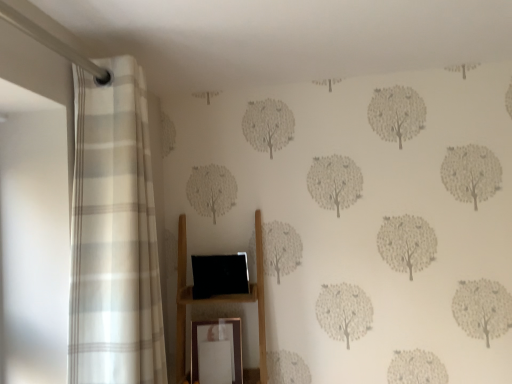
Question: From a real-world perspective, is white striped curtain at left on top of wooden shelf at center?

Choices:
 (A) no
 (B) yes

Answer: (B)

Question: Is white striped curtain at left positioned in front of wooden shelf at center?

Choices:
 (A) no
 (B) yes

Answer: (B)

Question: From the image's perspective, is white striped curtain at left below wooden shelf at center?

Choices:
 (A) no
 (B) yes

Answer: (A)

Question: From a real-world perspective, is white striped curtain at left positioned under wooden shelf at center based on gravity?

Choices:
 (A) no
 (B) yes

Answer: (A)

Question: Does white striped curtain at left touch wooden shelf at center?

Choices:
 (A) yes
 (B) no

Answer: (B)

Question: Is gold metallic picture frame at lower center in front of or behind white striped curtain at left in the image?

Choices:
 (A) behind
 (B) front

Answer: (A)

Question: Considering the positions of gold metallic picture frame at lower center and white striped curtain at left in the image, is gold metallic picture frame at lower center taller or shorter than white striped curtain at left?

Choices:
 (A) tall
 (B) short

Answer: (B)

Question: Considering the positions of gold metallic picture frame at lower center and white striped curtain at left in the image, is gold metallic picture frame at lower center bigger or smaller than white striped curtain at left?

Choices:
 (A) small
 (B) big

Answer: (A)

Question: From the image's perspective, is gold metallic picture frame at lower center positioned above or below white striped curtain at left?

Choices:
 (A) above
 (B) below

Answer: (B)

Question: Is white striped curtain at left spatially inside gold metallic picture frame at lower center, or outside of it?

Choices:
 (A) outside
 (B) inside

Answer: (A)

Question: Considering the positions of white striped curtain at left and gold metallic picture frame at lower center in the image, is white striped curtain at left wider or thinner than gold metallic picture frame at lower center?

Choices:
 (A) wide
 (B) thin

Answer: (A)

Question: From their relative heights in the image, would you say white striped curtain at left is taller or shorter than gold metallic picture frame at lower center?

Choices:
 (A) short
 (B) tall

Answer: (B)

Question: From a real-world perspective, is white striped curtain at left above or below gold metallic picture frame at lower center?

Choices:
 (A) below
 (B) above

Answer: (B)

Question: Considering their positions, is wooden shelf at center located in front of or behind gold metallic picture frame at lower center?

Choices:
 (A) behind
 (B) front

Answer: (B)

Question: From the image's perspective, is wooden shelf at center located above or below gold metallic picture frame at lower center?

Choices:
 (A) below
 (B) above

Answer: (B)